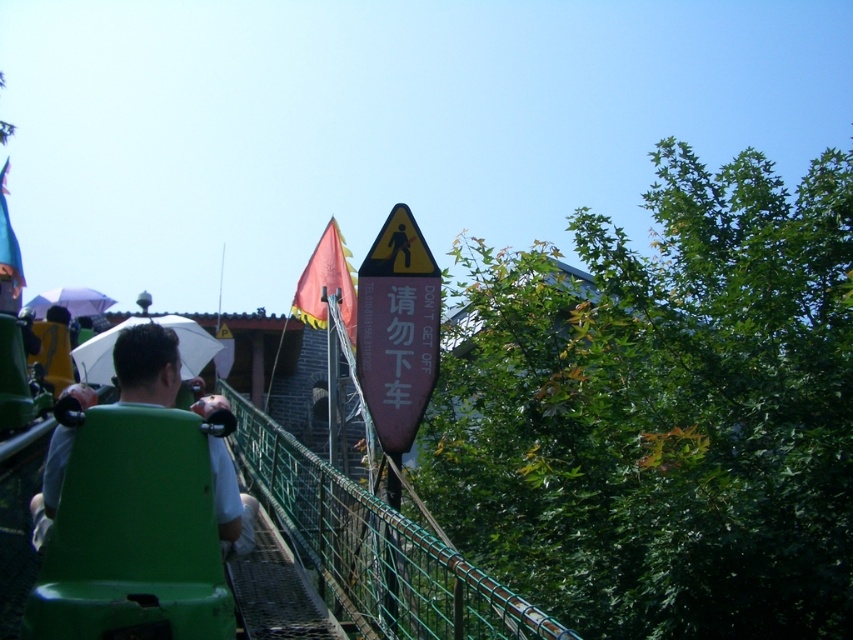
You are a visitor at the theme park and want to read the pink matte sign at center while sitting on the green plastic chair at center. Can you comfortably read it from that seat?

The pink matte sign at center and green plastic chair at center are 5.59 feet apart. Since the distance is relatively close, you should be able to comfortably read the sign while sitting on the green plastic chair at center.

You are a visitor at the amusement park and want to read the pink matte sign at center while sitting on the green plastic chair at center. Since you can only look forward, which direction should you turn your head to see the sign?

The pink matte sign at center is to the right of the green plastic chair at center, so you should turn your head to the right to see the sign.